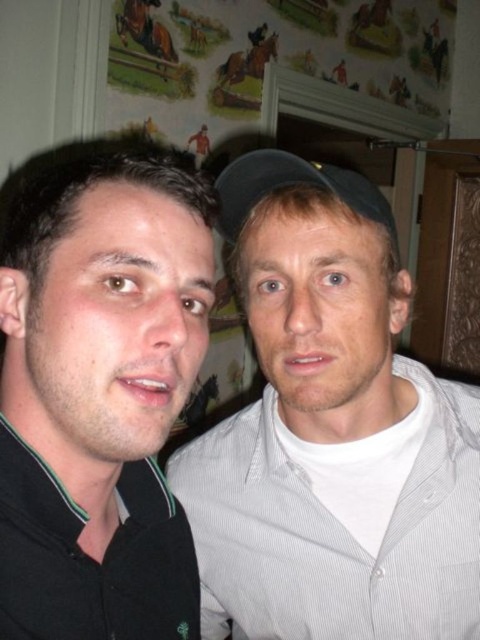
Question: Considering the relative positions of gray striped shirt at center and black matte shirt at left in the image provided, where is gray striped shirt at center located with respect to black matte shirt at left?

Choices:
 (A) above
 (B) below

Answer: (B)

Question: Can you confirm if gray striped shirt at center is positioned to the right of black fabric baseball cap at center?

Choices:
 (A) no
 (B) yes

Answer: (B)

Question: Among these points, which one is farthest from the camera?

Choices:
 (A) (129, 570)
 (B) (233, 240)
 (C) (345, 385)

Answer: (B)

Question: Based on their relative distances, which object is nearer to the black fabric baseball cap at center?

Choices:
 (A) gray striped shirt at center
 (B) black matte shirt at left

Answer: (B)

Question: Which object is the farthest from the gray striped shirt at center?

Choices:
 (A) black matte shirt at left
 (B) black fabric baseball cap at center

Answer: (B)

Question: Does gray striped shirt at center have a larger size compared to black fabric baseball cap at center?

Choices:
 (A) no
 (B) yes

Answer: (B)